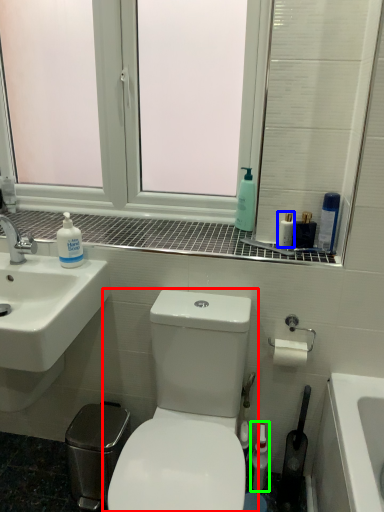
Question: Based on their relative distances, which object is nearer to toilet (highlighted by a red box)? Choose from mouthwash (highlighted by a blue box) and mouthwash (highlighted by a green box).

Choices:
 (A) mouthwash
 (B) mouthwash

Answer: (B)